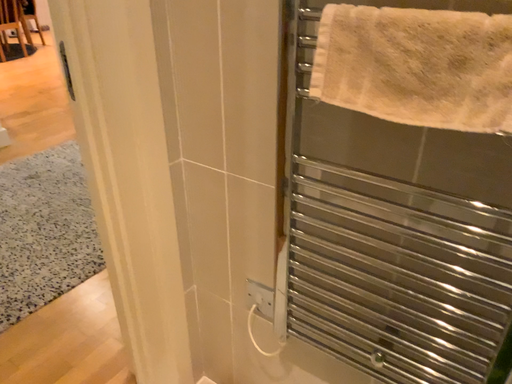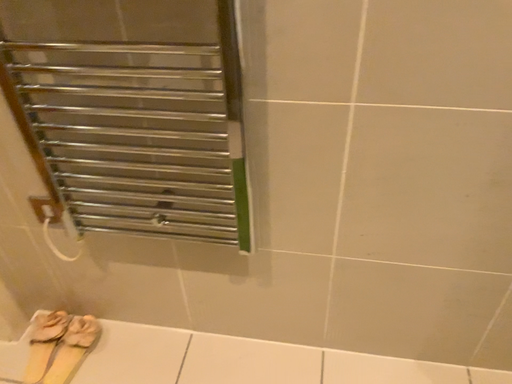
Question: Which way did the camera rotate in the video?

Choices:
 (A) rotated downward
 (B) rotated upward

Answer: (A)